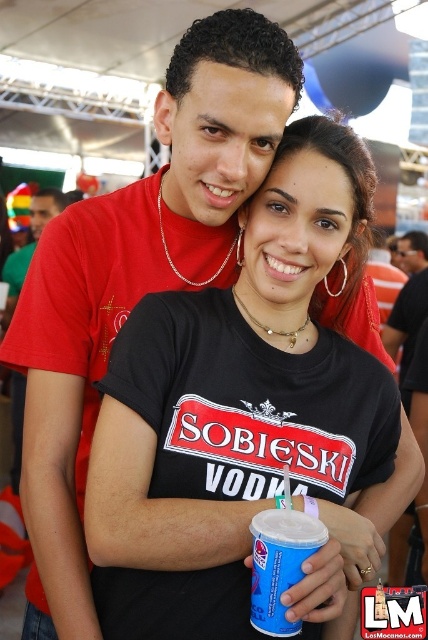
Question: Does black matte cup at center have a greater width compared to blue paper cup at center?

Choices:
 (A) no
 (B) yes

Answer: (B)

Question: Is blue paper cup at center bigger than matte red t-shirt at upper left?

Choices:
 (A) no
 (B) yes

Answer: (A)

Question: Does blue paper cup at center appear on the left side of matte red t-shirt at upper left?

Choices:
 (A) no
 (B) yes

Answer: (A)

Question: Which is nearer to the black matte cup at center?

Choices:
 (A) matte red t-shirt at upper left
 (B) blue paper cup at center

Answer: (B)

Question: Which point is farther from the camera taking this photo?

Choices:
 (A) (303, 556)
 (B) (36, 195)

Answer: (B)

Question: Which of these objects is positioned farthest from the blue paper cup at center?

Choices:
 (A) matte red t-shirt at upper left
 (B) black matte cup at center

Answer: (A)